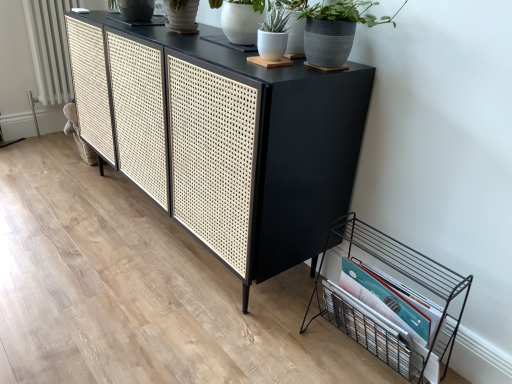
This screenshot has width=512, height=384. Identify the location of vacant space that is to the left of black wire magazine rack at lower right. (266, 337).